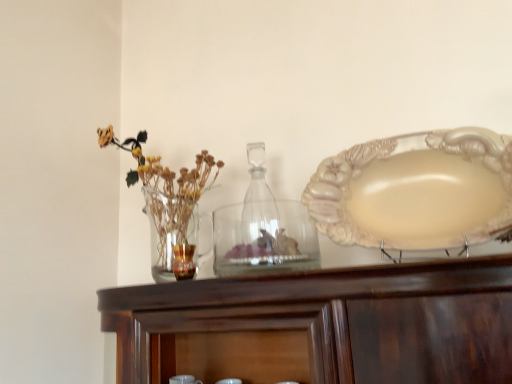
Question: From a real-world perspective, is transparent glass bottle at center positioned over matte cream plate at right based on gravity?

Choices:
 (A) no
 (B) yes

Answer: (B)

Question: Is transparent glass bottle at center looking in the opposite direction of matte cream plate at right?

Choices:
 (A) yes
 (B) no

Answer: (B)

Question: Can you confirm if transparent glass bottle at center is smaller than matte cream plate at right?

Choices:
 (A) yes
 (B) no

Answer: (A)

Question: Is transparent glass bottle at center wider than matte cream plate at right?

Choices:
 (A) no
 (B) yes

Answer: (A)

Question: Considering the relative sizes of transparent glass bottle at center and matte cream plate at right in the image provided, is transparent glass bottle at center bigger than matte cream plate at right?

Choices:
 (A) no
 (B) yes

Answer: (A)

Question: In terms of height, does transparent glass bottle at center look taller or shorter compared to matte cream plate at right?

Choices:
 (A) short
 (B) tall

Answer: (B)

Question: From a real-world perspective, relative to matte cream plate at right, is transparent glass bottle at center vertically above or below?

Choices:
 (A) above
 (B) below

Answer: (A)

Question: From the image's perspective, relative to matte cream plate at right, is transparent glass bottle at center above or below?

Choices:
 (A) below
 (B) above

Answer: (A)

Question: Choose the correct answer: Is transparent glass bottle at center inside matte cream plate at right or outside it?

Choices:
 (A) inside
 (B) outside

Answer: (B)

Question: From a real-world perspective, is clear glass jar at center, the 2th tableware viewed from the left, physically located above or below matte cream plate at right?

Choices:
 (A) above
 (B) below

Answer: (B)

Question: Would you say clear glass jar at center, the 2th tableware viewed from the left, is to the left or to the right of matte cream plate at right in the picture?

Choices:
 (A) left
 (B) right

Answer: (A)

Question: Considering their positions, is clear glass jar at center, placed as the first tableware when sorted from right to left, located in front of or behind matte cream plate at right?

Choices:
 (A) front
 (B) behind

Answer: (B)

Question: Is clear glass jar at center, placed as the first tableware when sorted from right to left, bigger or smaller than matte cream plate at right?

Choices:
 (A) big
 (B) small

Answer: (B)

Question: Considering their positions, is translucent glass candle at center, which is the 2th tableware from right to left, located in front of or behind clear glass jar at center, the 2th tableware viewed from the left?

Choices:
 (A) behind
 (B) front

Answer: (A)

Question: Is translucent glass candle at center, which is counted as the first tableware, starting from the left, taller or shorter than clear glass jar at center, placed as the first tableware when sorted from right to left?

Choices:
 (A) short
 (B) tall

Answer: (A)